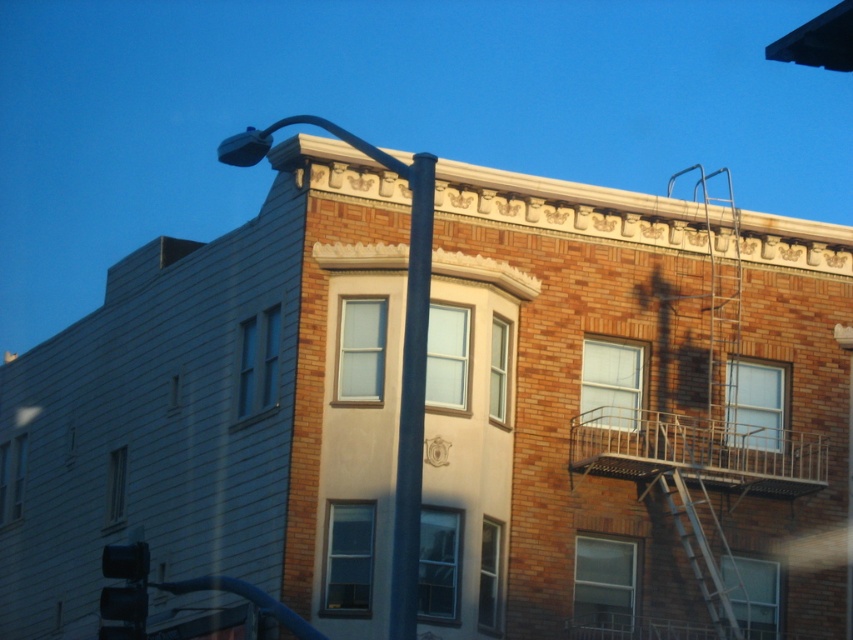
You are a delivery person trying to secure a package on the back of your bike. You need to know which object is taller between the smooth black pole at center and the black glass traffic light at lower left to determine if the package will clear it. Can you tell me which one is taller?

The smooth black pole at center is taller than the black glass traffic light at lower left, so the package must be secured below the height of the smooth black pole at center to avoid hitting it.

You are a pedestrian standing at the corner of the street looking at the building. You see the smooth black pole at center and the black glass traffic light at lower left. Which object is positioned more to the east side of the scene?

The smooth black pole at center is to the right of the black glass traffic light at lower left. Since you are facing the building from the corner, the right side would correspond to the east direction. Therefore, the smooth black pole at center is positioned more to the east side of the scene.